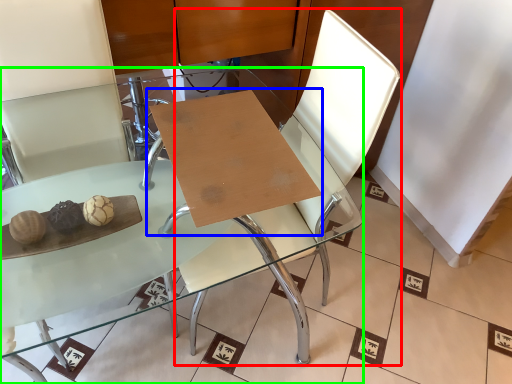
Question: Which object is positioned farthest from swivel chair (highlighted by a red box)? Select from table (highlighted by a blue box) and table (highlighted by a green box).

Choices:
 (A) table
 (B) table

Answer: (A)